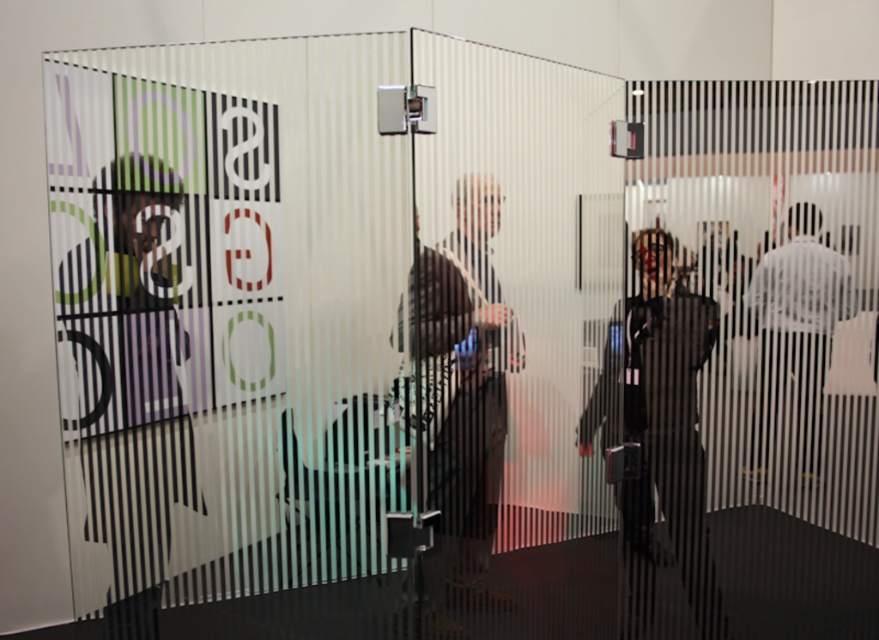
Question: Is matte black shirt at left positioned before black leather jacket at center?

Choices:
 (A) yes
 (B) no

Answer: (B)

Question: Which of the following is the closest to the observer?

Choices:
 (A) (665, 368)
 (B) (144, 236)
 (C) (460, 492)
 (D) (761, 310)

Answer: (C)

Question: Does matte black shirt at left appear on the right side of matte black laptop at center?

Choices:
 (A) no
 (B) yes

Answer: (A)

Question: From the image, what is the correct spatial relationship of matte black shirt at left in relation to white matte shirt at right?

Choices:
 (A) right
 (B) left

Answer: (B)

Question: Which object is farther from the camera taking this photo?

Choices:
 (A) matte black shirt at left
 (B) matte black laptop at center
 (C) white matte shirt at right

Answer: (C)

Question: Which object is closer to the camera taking this photo?

Choices:
 (A) black leather jacket at center
 (B) matte black laptop at center
 (C) matte black shirt at left

Answer: (B)